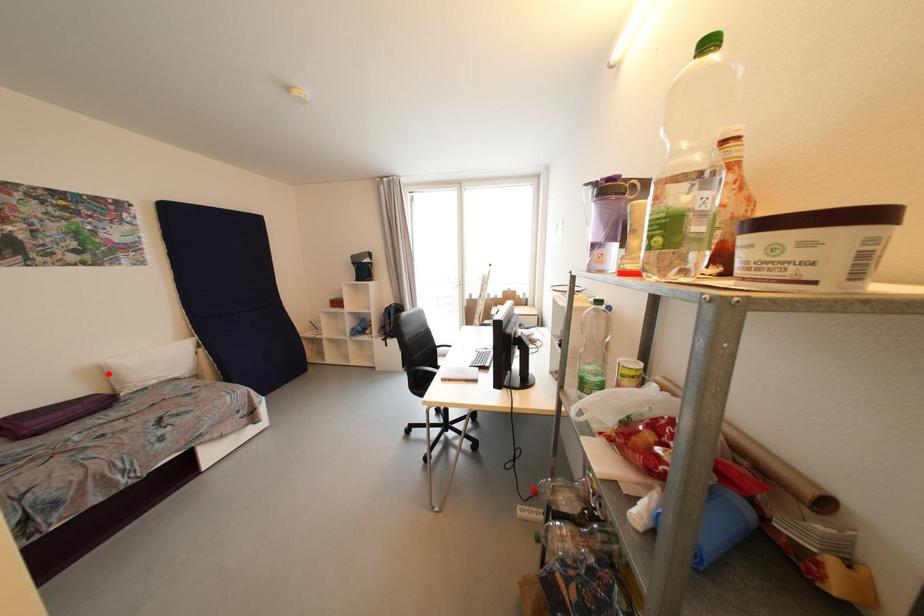
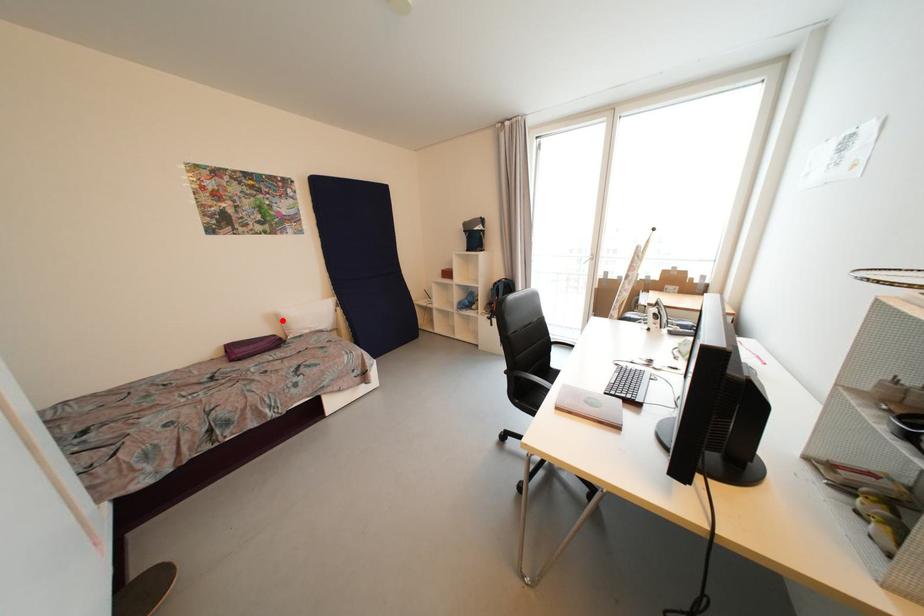
I am providing you with two images of the same scene from different viewpoints. A red point is marked on the first image and another point is marked on the second image. Is the red point in image1 aligned with the point shown in image2?

Yes